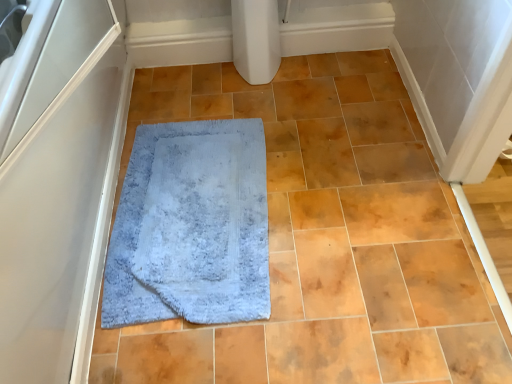
Question: From a real-world perspective, is blue soft carpet at center positioned under light blue shaggy rug at center based on gravity?

Choices:
 (A) yes
 (B) no

Answer: (B)

Question: From a real-world perspective, is blue soft carpet at center on top of light blue shaggy rug at center?

Choices:
 (A) yes
 (B) no

Answer: (A)

Question: Is blue soft carpet at center aimed at light blue shaggy rug at center?

Choices:
 (A) no
 (B) yes

Answer: (B)

Question: Is blue soft carpet at center shorter than light blue shaggy rug at center?

Choices:
 (A) no
 (B) yes

Answer: (A)

Question: Is blue soft carpet at center outside of light blue shaggy rug at center?

Choices:
 (A) yes
 (B) no

Answer: (A)

Question: Is blue soft carpet at center further to the viewer compared to light blue shaggy rug at center?

Choices:
 (A) no
 (B) yes

Answer: (A)

Question: Can you confirm if white matte screen door at left is taller than light blue shaggy rug at center?

Choices:
 (A) yes
 (B) no

Answer: (A)

Question: Does white matte screen door at left have a greater width compared to light blue shaggy rug at center?

Choices:
 (A) yes
 (B) no

Answer: (A)

Question: Is white matte screen door at left completely or partially outside of light blue shaggy rug at center?

Choices:
 (A) no
 (B) yes

Answer: (B)

Question: Is white matte screen door at left not near light blue shaggy rug at center?

Choices:
 (A) no
 (B) yes

Answer: (A)

Question: Considering the relative sizes of white matte screen door at left and light blue shaggy rug at center in the image provided, is white matte screen door at left thinner than light blue shaggy rug at center?

Choices:
 (A) no
 (B) yes

Answer: (A)

Question: Does white matte screen door at left lie in front of light blue shaggy rug at center?

Choices:
 (A) yes
 (B) no

Answer: (A)

Question: Does light blue shaggy rug at center have a lesser width compared to blue soft carpet at center?

Choices:
 (A) yes
 (B) no

Answer: (A)